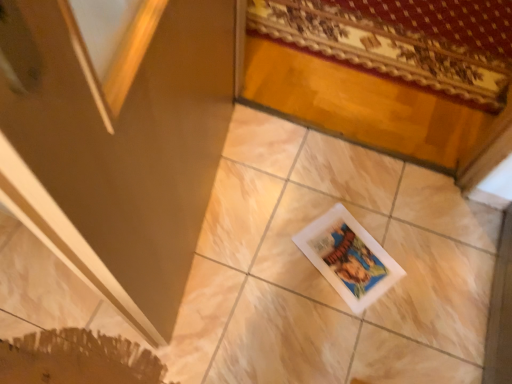
This screenshot has height=384, width=512. I want to click on vacant space positioned to the left of white matte picture frame at center, so click(x=271, y=253).